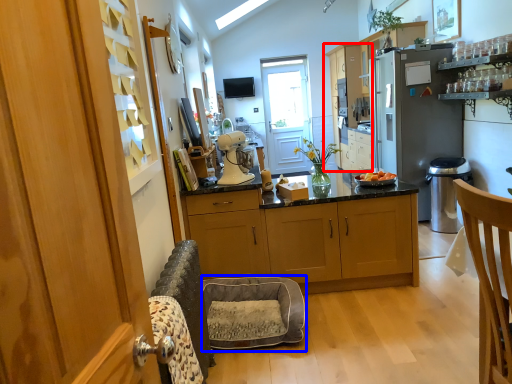
Question: Among these objects, which one is nearest to the camera, cabinetry (highlighted by a red box) or cat bed (highlighted by a blue box)?

Choices:
 (A) cabinetry
 (B) cat bed

Answer: (B)